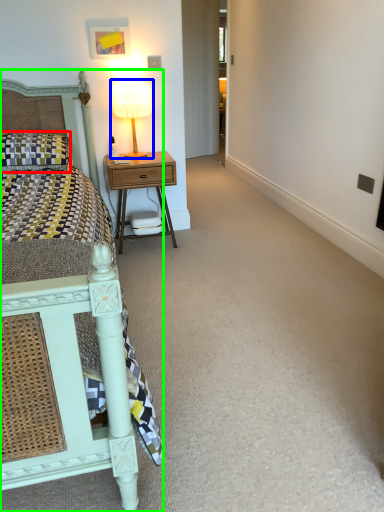
Question: Estimate the real-world distances between objects in this image. Which object is closer to pillow (highlighted by a red box), bedside lamp (highlighted by a blue box) or bed (highlighted by a green box)?

Choices:
 (A) bedside lamp
 (B) bed

Answer: (A)